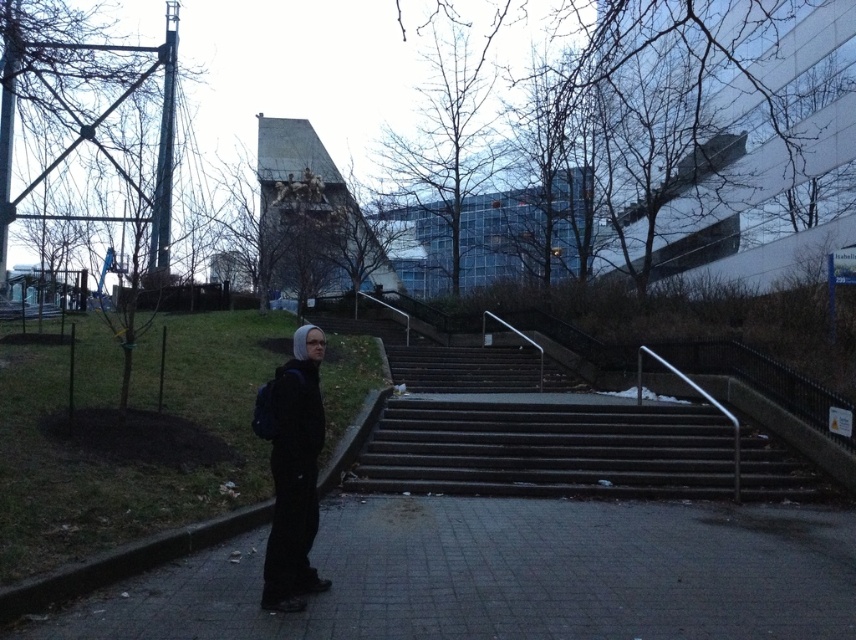
You are a delivery drone operator. Your drone is currently hovering above the dark gray concrete pavement at lower center and needs to deliver a package to a person wearing black matte clothing at center. According to the scene description, can the drone safely land on the pavement directly below the person?

The dark gray concrete pavement at lower center is positioned under black matte clothing at center, so the drone can safely land on the pavement directly below the person since the pavement is located beneath them.

You are standing at the entrance of the building complex and want to reach the dark gray concrete stairs at center. According to the coordinates provided, in which direction should you walk from your current position?

The dark gray concrete stairs at center are located at coordinates point (547,449). Since you are at the entrance, you should walk towards the center of the image to reach them.

You are a delivery person trying to park your electric scooter. The scooter requires a minimum of 1.5 square meters of space to park safely. You see the dark gray concrete pavement at lower center and the dark gray concrete stairs at center. Which area would be suitable for parking your scooter?

The dark gray concrete stairs at center would be suitable for parking the scooter since the dark gray concrete pavement at lower center has a smaller size compared to dark gray concrete stairs at center, making the stairs area larger and sufficient for the scooter.